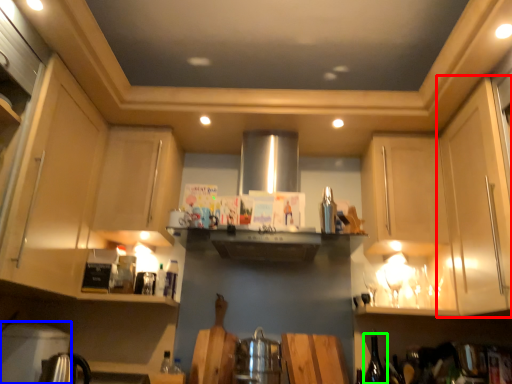
Question: Which is nearer to the cabinetry (highlighted by a red box)? appliance (highlighted by a blue box) or wine bottle (highlighted by a green box).

Choices:
 (A) appliance
 (B) wine bottle

Answer: (B)